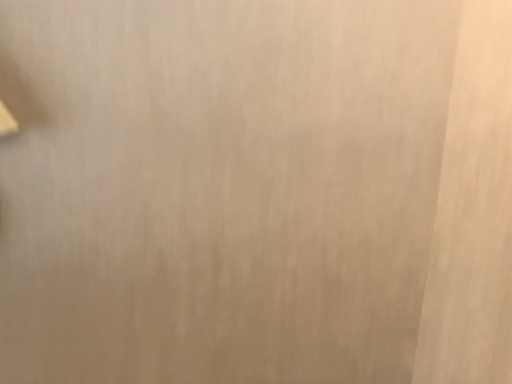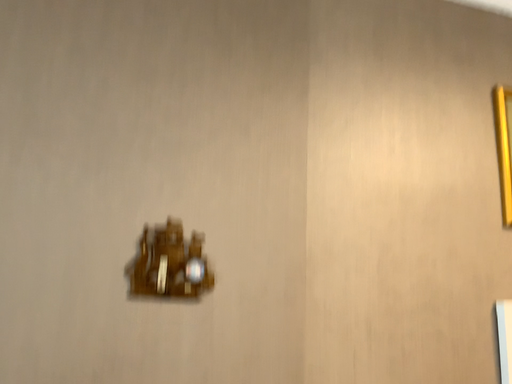
Question: Which way did the camera rotate in the video?

Choices:
 (A) rotated left
 (B) rotated right

Answer: (B)